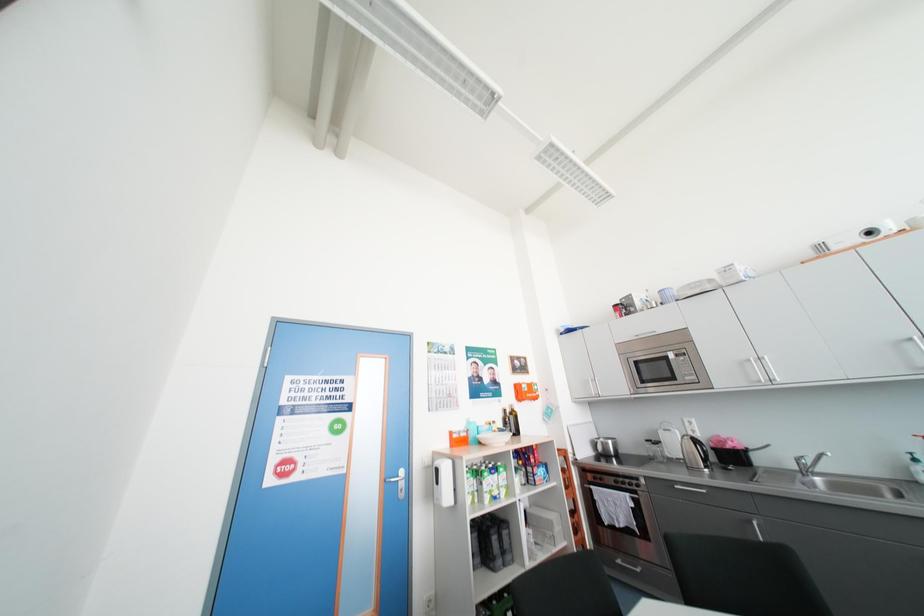
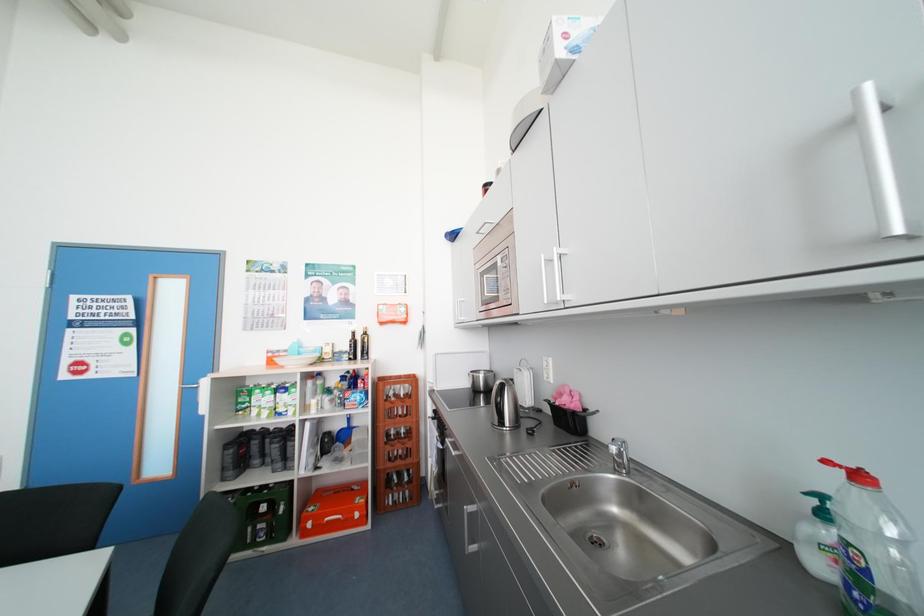
In a continuous first-person perspective shot, in which direction is the camera moving?

The movement direction of the cameraman is right, forward.